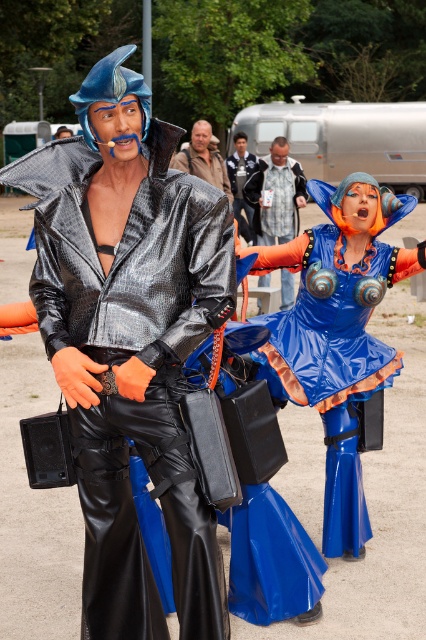
You are organizing a costume party and need to ensure that all costumes are displayed properly. Given the orange fabric pants at center and the brown leather jacket at center, which item requires more space for display?

The orange fabric pants at center requires more space for display because it has a larger size compared to the brown leather jacket at center.

You are a photographer positioned at the camera. You need to capture a photo of the orange fabric pants at center. Considering the distance between you and the pants, will you need a telephoto lens to ensure the pants appear large enough in the frame?

The orange fabric pants at center are 11.62 meters away from the camera. Since this distance is quite far, using a telephoto lens would help magnify the pants and make them appear larger in the photo, ensuring they are clearly visible and prominent in the frame.